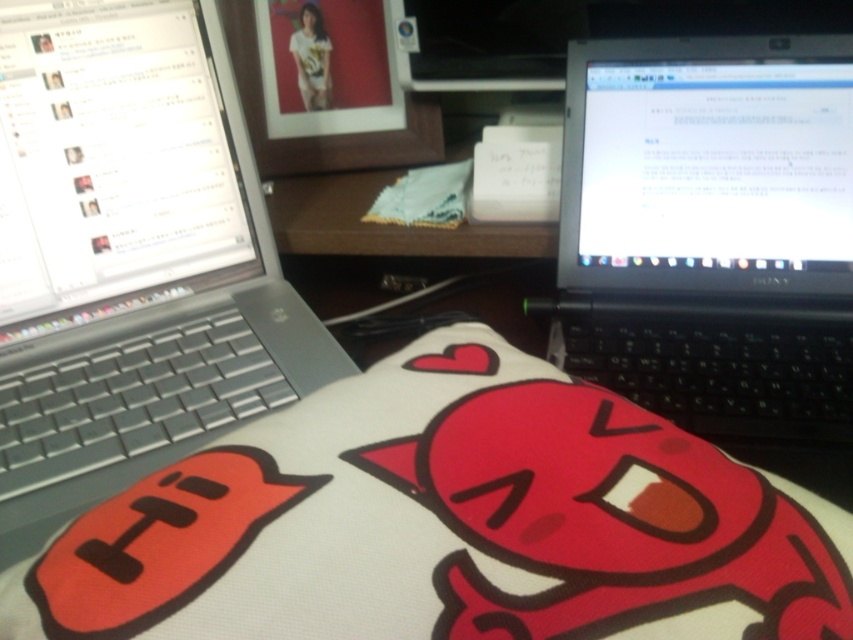
You are a delivery person who needs to place a small package on the desk without blocking the laptops. The package is 12 inches long. Can you place it between the silver metallic laptop at left and the other laptop on the right?

The silver metallic laptop at left is 18.72 inches away from viewer. Since the package is 12 inches long, it can be placed between the silver metallic laptop at left and the other laptop on the right as there is enough space.

You are organizing a desk and need to place the white fabric pillow with cartoon character at center and the silver metallic laptop at left. Given their sizes, which object should you place first to ensure there is enough space for both?

Since the white fabric pillow with cartoon character at center is smaller than the silver metallic laptop at left, you should place the silver metallic laptop at left first to ensure there is enough space for both.